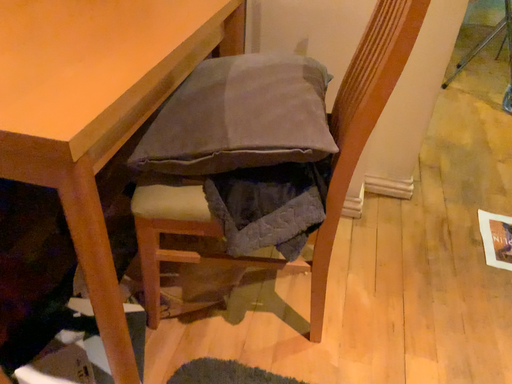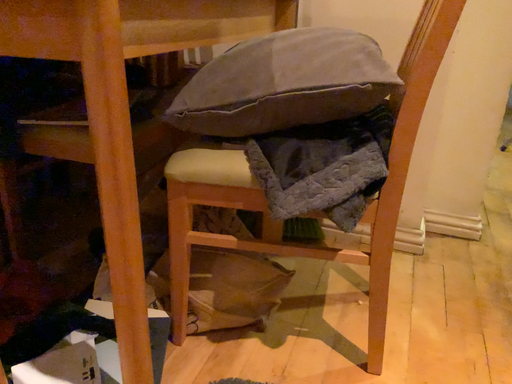
Question: Which way did the camera rotate in the video?

Choices:
 (A) rotated downward
 (B) rotated upward

Answer: (B)